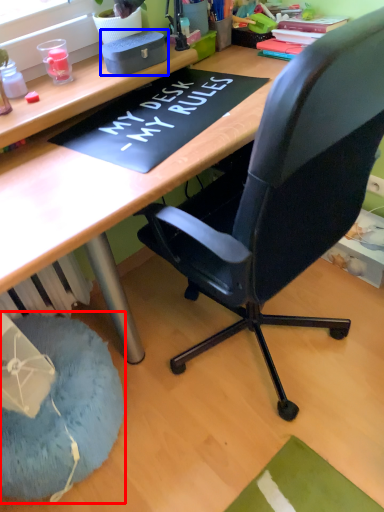
Question: Among these objects, which one is nearest to the camera, bean bag chair (highlighted by a red box) or stationery (highlighted by a blue box)?

Choices:
 (A) bean bag chair
 (B) stationery

Answer: (A)